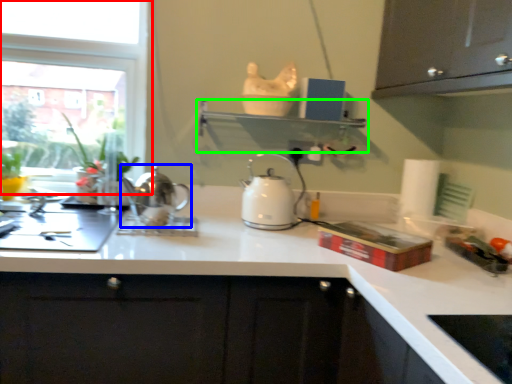
Question: Considering the real-world distances, which object is farthest from window (highlighted by a red box)? kettle (highlighted by a blue box) or shelf (highlighted by a green box)?

Choices:
 (A) kettle
 (B) shelf

Answer: (B)